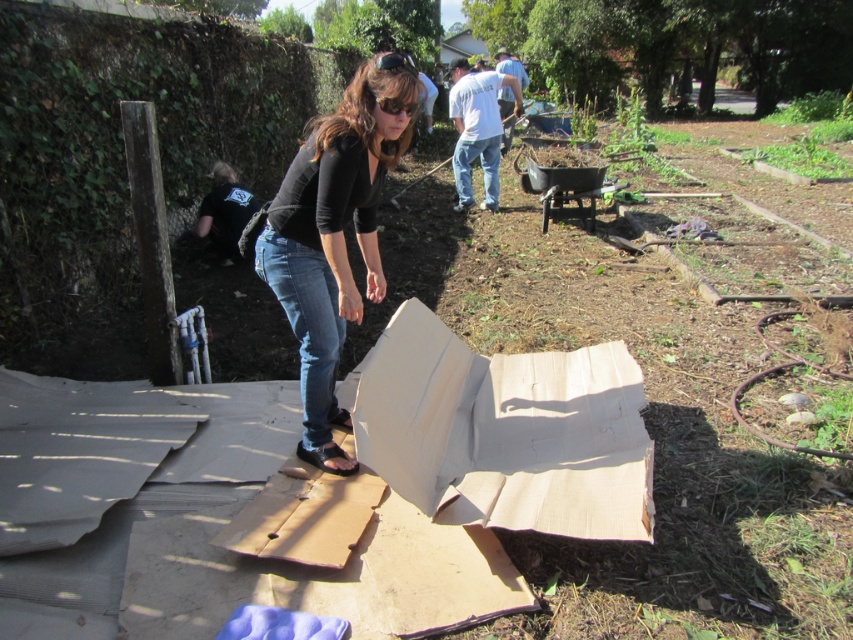
You are standing in the community garden and see the white cardboard box at center and the matte black shirt at center. Which object is nearer to you?

The white cardboard box at center is closer to the viewer than the matte black shirt at center.

You are a gardener who needs to place a 1.2 meter wide gardening tool next to the white cardboard box at center and the matte black shirt at center. Which object should you place the tool next to to ensure it fits without overlapping?

The white cardboard box at center has a larger width than the matte black shirt at center, so placing the 1.2 meter wide gardening tool next to the white cardboard box at center would provide enough space to fit without overlapping.

You are standing at point (277, 268) and want to walk to point (552, 396). Is the destination point behind you or in front of you?

The destination point (552, 396) is behind you since it is located behind point (277, 268) where you are standing.